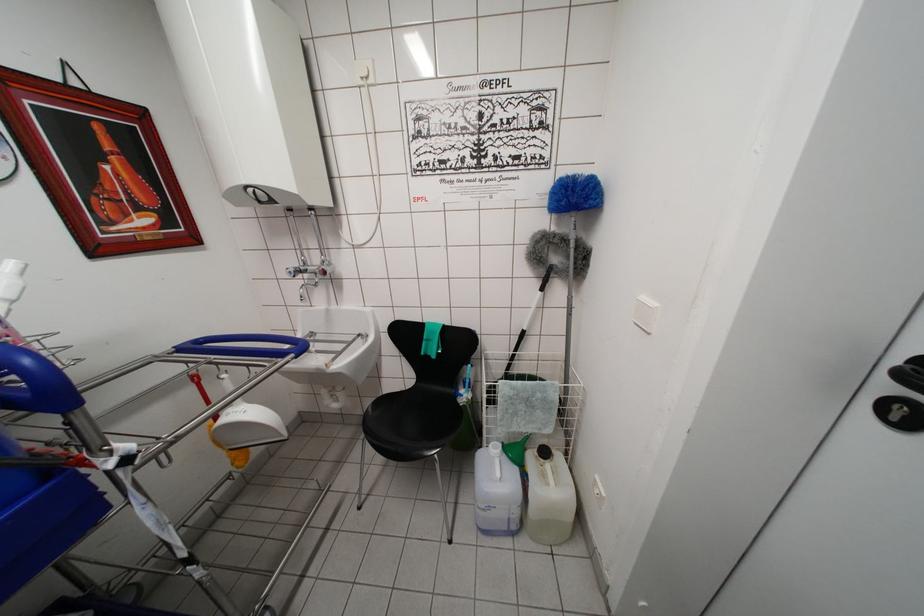
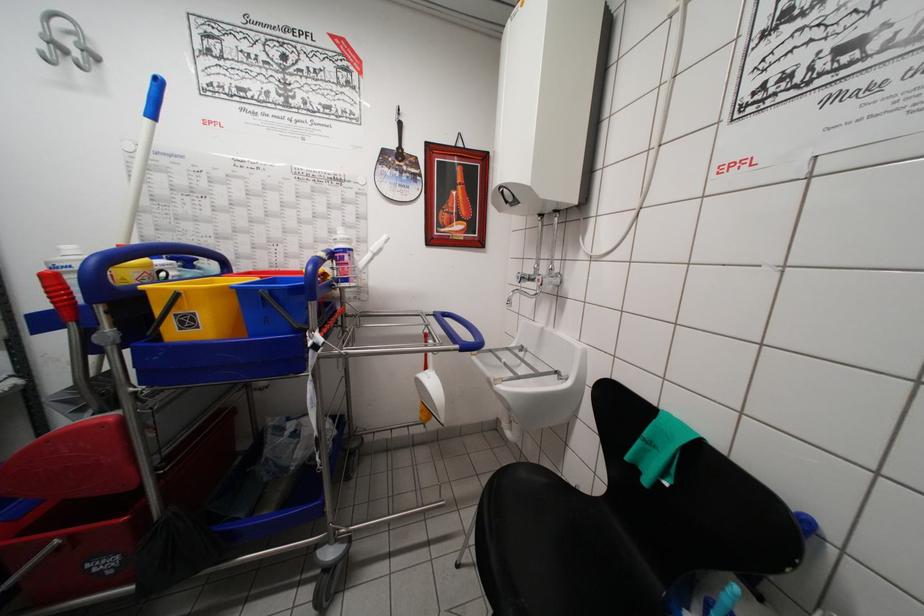
Question: How did the camera likely rotate?

Choices:
 (A) Left
 (B) Right
 (C) Up
 (D) Down

Answer: (A)